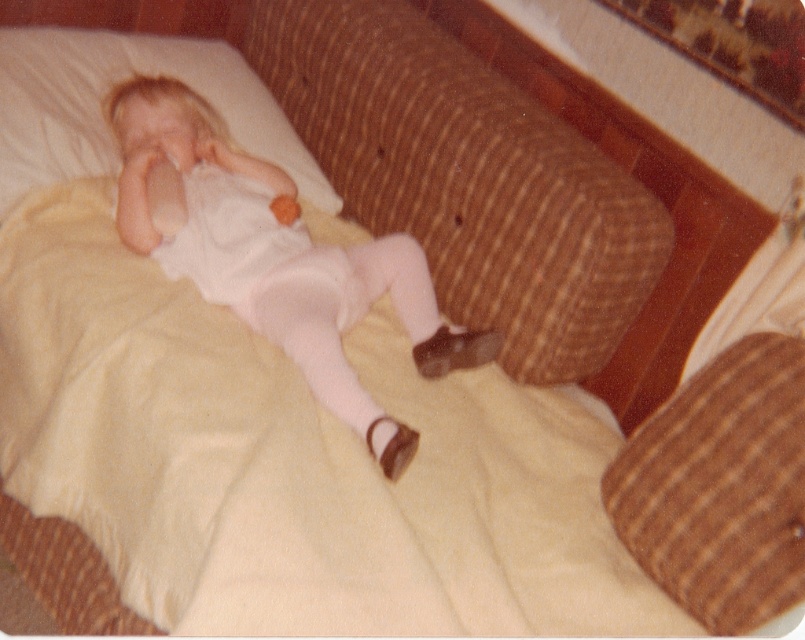
Question: Can you confirm if white matte onesie at center is positioned above white soft pillow at upper left?

Choices:
 (A) no
 (B) yes

Answer: (A)

Question: Which of the following is the closest to the observer?

Choices:
 (A) (145, 38)
 (B) (240, 292)

Answer: (B)

Question: Which point appears closest to the camera in this image?

Choices:
 (A) (364, 248)
 (B) (188, 67)
 (C) (644, 486)

Answer: (C)

Question: Is white matte onesie at center thinner than white soft pillow at upper left?

Choices:
 (A) no
 (B) yes

Answer: (A)

Question: Among these points, which one is nearest to the camera?

Choices:
 (A) (221, 289)
 (B) (727, 456)
 (C) (56, 161)

Answer: (B)

Question: Is brown corduroy pillow at center above white soft pillow at upper left?

Choices:
 (A) yes
 (B) no

Answer: (B)